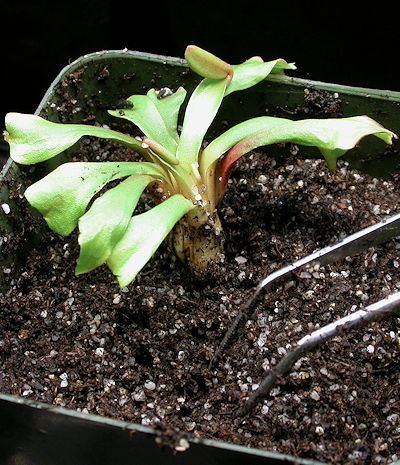
Find the location of `metal pan`. metal pan is located at coordinates (69, 422), (357, 95).